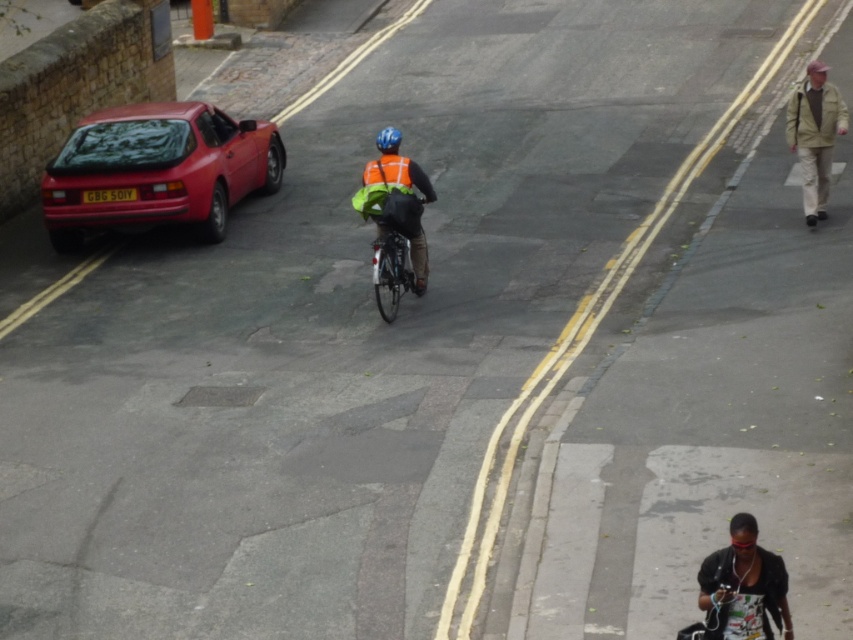
Question: Does black fabric headphones at lower right appear under blue matte helmet at center?

Choices:
 (A) no
 (B) yes

Answer: (B)

Question: Which point is farther to the camera?

Choices:
 (A) orange reflective safety vest at center
 (B) green reflective fabric bicycle at center
 (C) black fabric headphones at lower right

Answer: (A)

Question: Does reflective orange vest at center appear on the left side of orange reflective safety vest at center?

Choices:
 (A) yes
 (B) no

Answer: (B)

Question: Which point is farther from the camera taking this photo?

Choices:
 (A) (140, 193)
 (B) (389, 161)
 (C) (410, 288)
 (D) (392, 161)

Answer: (A)

Question: Can you confirm if shiny red car at left is thinner than blue matte helmet at center?

Choices:
 (A) yes
 (B) no

Answer: (B)

Question: Which object is the farthest from the blue matte helmet at center?

Choices:
 (A) shiny red car at left
 (B) orange reflective safety vest at center
 (C) black fabric headphones at lower right
 (D) khaki jacket at upper right

Answer: (C)